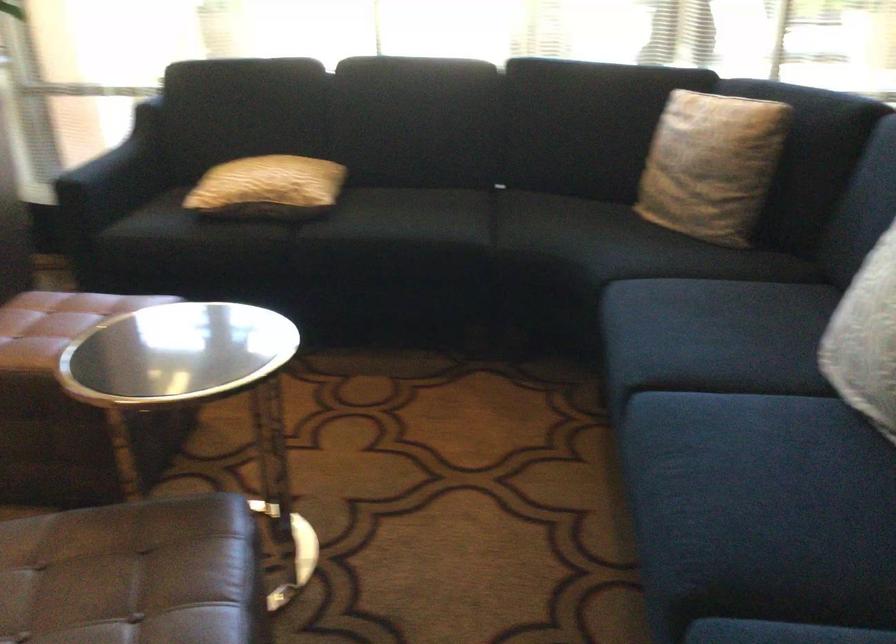
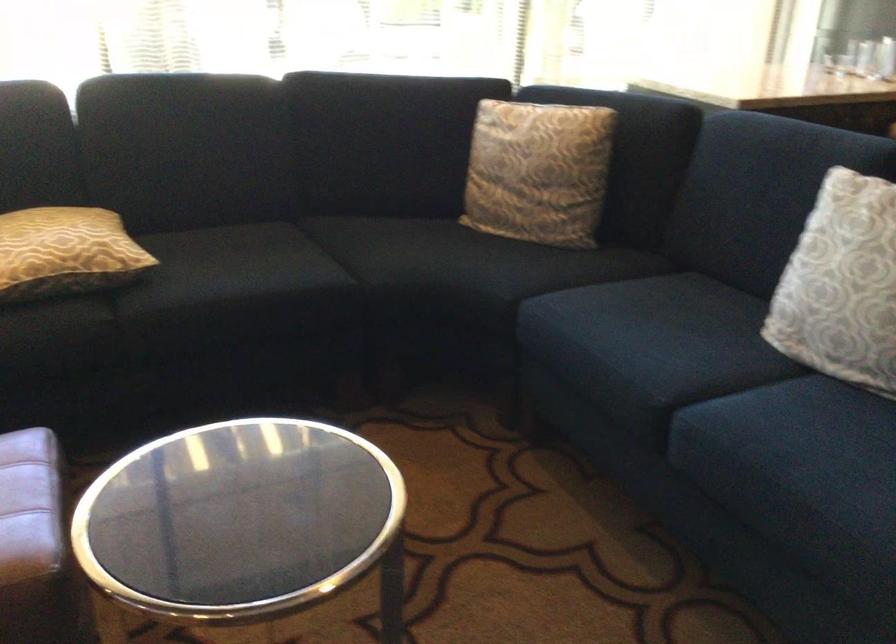
Question: Based on the continuous images, in which direction is the camera rotating? Reply with the corresponding letter.

Choices:
 (A) Left
 (B) Right
 (C) Up
 (D) Down

Answer: (B)